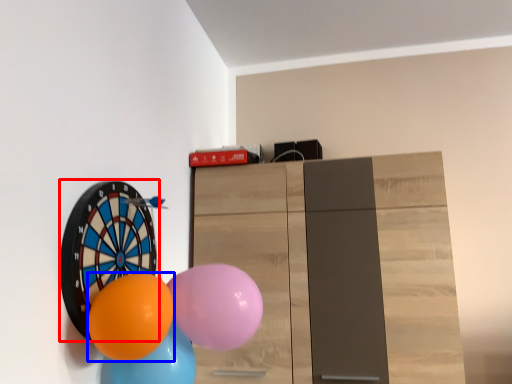
Question: Which point is closer to the camera, balloon (highlighted by a red box) or balloon (highlighted by a blue box)?

Choices:
 (A) balloon
 (B) balloon

Answer: (B)